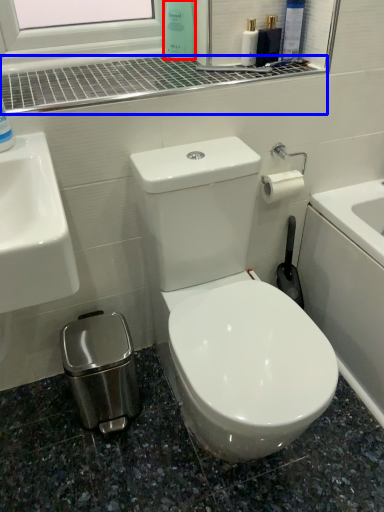
Question: Among these objects, which one is nearest to the camera, cleaning product (highlighted by a red box) or window sill (highlighted by a blue box)?

Choices:
 (A) cleaning product
 (B) window sill

Answer: (B)